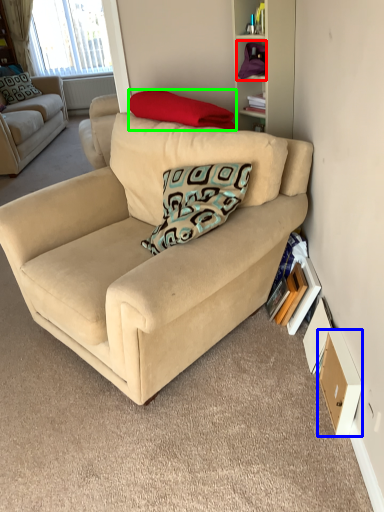
Question: Based on their relative distances, which object is farther from shelf (highlighted by a red box)? Choose from drawer (highlighted by a blue box) and pillow (highlighted by a green box).

Choices:
 (A) drawer
 (B) pillow

Answer: (A)